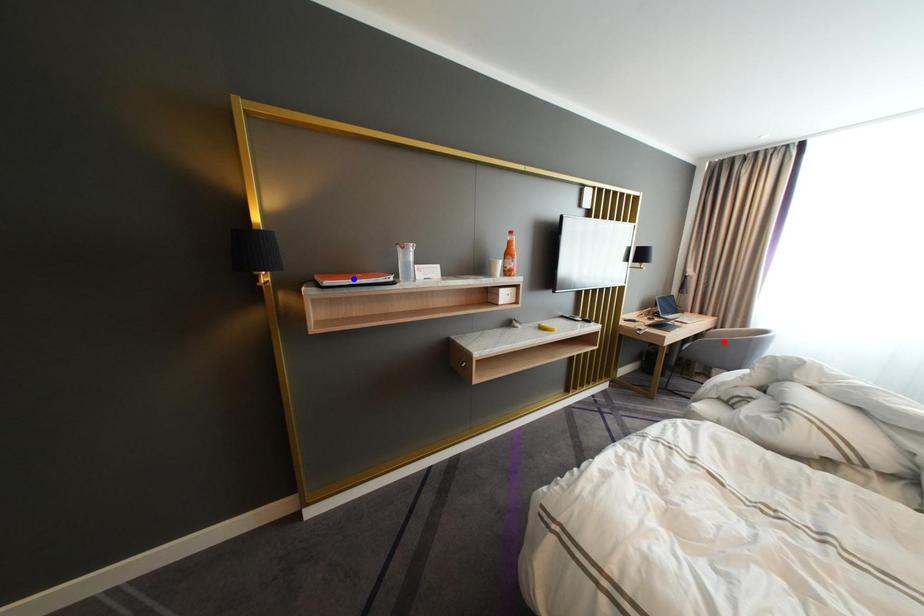
Question: Which of the two points in the image is closer to the camera?

Choices:
 (A) Blue point is closer.
 (B) Red point is closer.

Answer: (A)